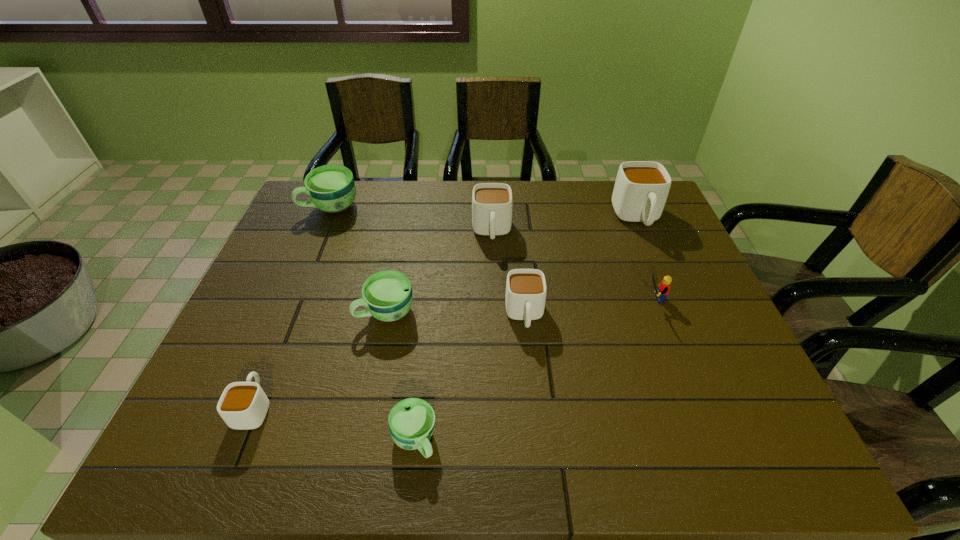
Locate an element on the screen. This screenshot has height=540, width=960. blank area located 0.300m on the side with the handle of the smallest white cup is located at coordinates (303, 287).

Find the location of a particular element. free spot located on the side with the handle of the smallest white cup is located at coordinates (297, 303).

The height and width of the screenshot is (540, 960). Identify the location of vacant space located on the back of the smallest blue cup. (427, 324).

The height and width of the screenshot is (540, 960). I want to click on cup that is at the right edge, so click(641, 189).

Find the location of a particular element. This screenshot has height=540, width=960. Lego at the right edge is located at coordinates (664, 287).

Where is `object situated at the far left corner`? The width and height of the screenshot is (960, 540). object situated at the far left corner is located at coordinates (331, 188).

Locate an element on the screen. object located in the near left corner section of the desktop is located at coordinates (243, 405).

Locate an element on the screen. The width and height of the screenshot is (960, 540). object that is at the far right corner is located at coordinates (641, 189).

Find the location of a particular element. This screenshot has height=540, width=960. vacant region at the far edge is located at coordinates (368, 199).

Where is `vacant point at the near edge`? This screenshot has height=540, width=960. vacant point at the near edge is located at coordinates (610, 436).